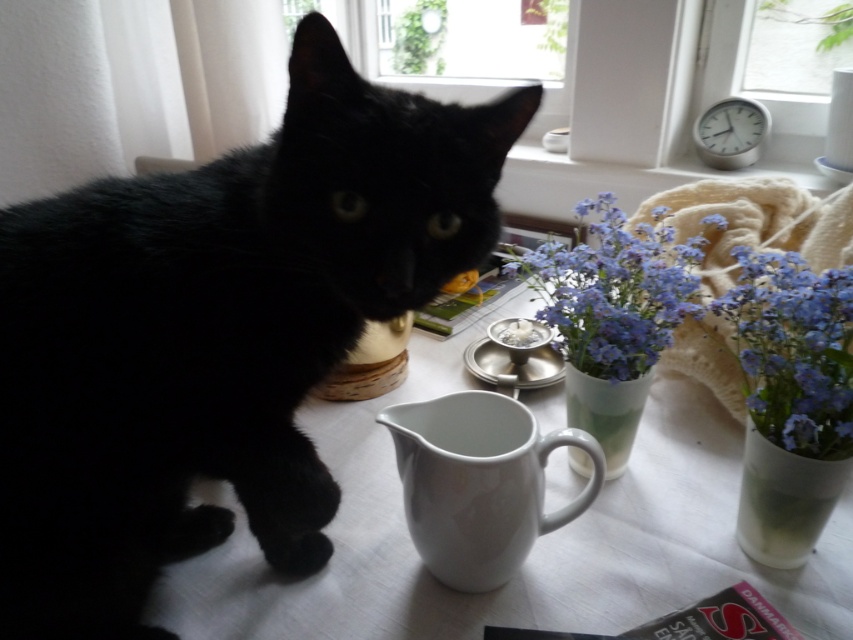
Does black fur cat at left have a greater height compared to matte ceramic vase at upper right?

Indeed, black fur cat at left has a greater height compared to matte ceramic vase at upper right.

What do you see at coordinates (216, 333) in the screenshot? The height and width of the screenshot is (640, 853). I see `black fur cat at left` at bounding box center [216, 333].

I want to click on black fur cat at left, so click(x=216, y=333).

Which of these two, white glossy table at center or matte ceramic vase at upper right, stands shorter?

Standing shorter between the two is matte ceramic vase at upper right.

Which is above, white glossy table at center or matte ceramic vase at upper right?

matte ceramic vase at upper right is above.

This screenshot has width=853, height=640. In order to click on white glossy table at center in this screenshot , I will do click(x=532, y=548).

In the scene shown: Can you confirm if white ceramic mug at lower center is positioned above transparent glass window at upper center?

Incorrect, white ceramic mug at lower center is not positioned above transparent glass window at upper center.

Is the position of white ceramic mug at lower center less distant than that of transparent glass window at upper center?

Yes.

Which is in front, point (431, 426) or point (505, 10)?

Point (431, 426) is more forward.

At what (x,y) coordinates should I click in order to perform the action: click on white ceramic mug at lower center. Please return your answer as a coordinate pair (x, y). This screenshot has height=640, width=853. Looking at the image, I should click on (479, 483).